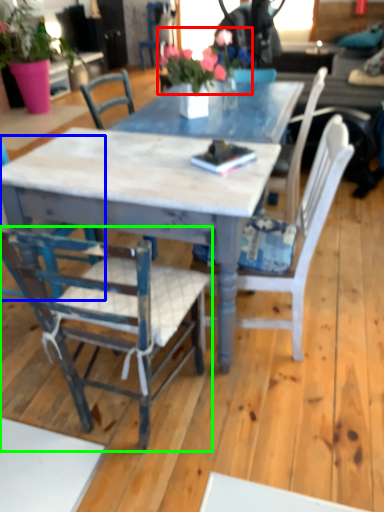
Question: Estimate the real-world distances between objects in this image. Which object is closer to floral arrangement (highlighted by a red box), chair (highlighted by a blue box) or chair (highlighted by a green box)?

Choices:
 (A) chair
 (B) chair

Answer: (A)